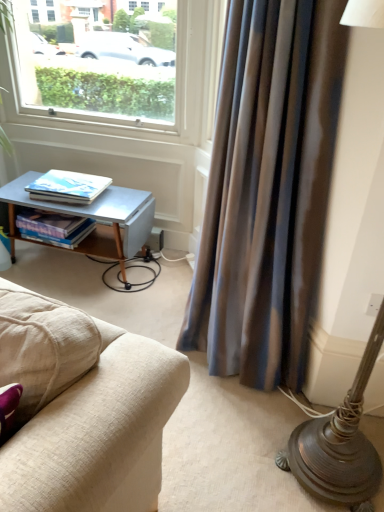
Image resolution: width=384 pixels, height=512 pixels. I want to click on empty space that is to the right of matte white book at left, which is counted as the second book, starting from the bottom, so click(x=118, y=201).